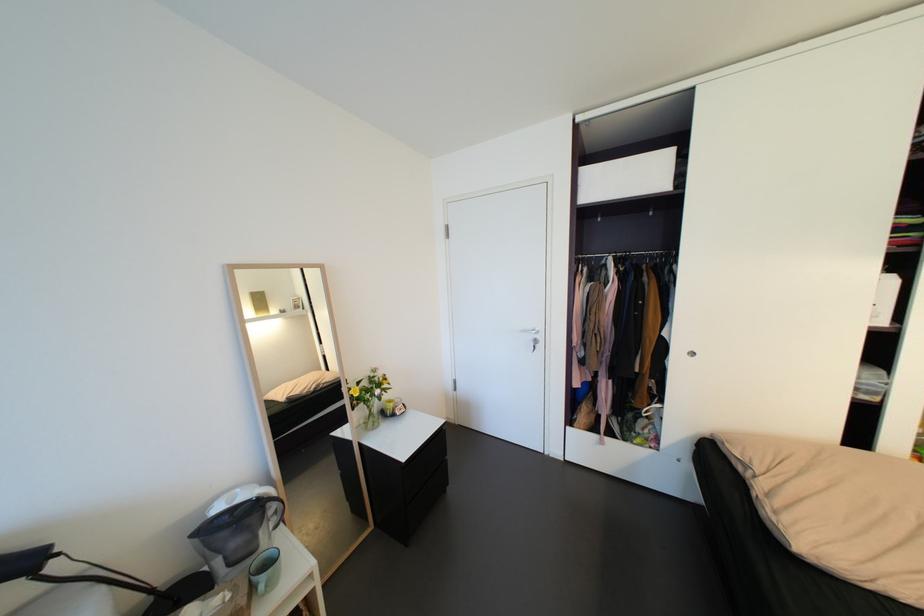
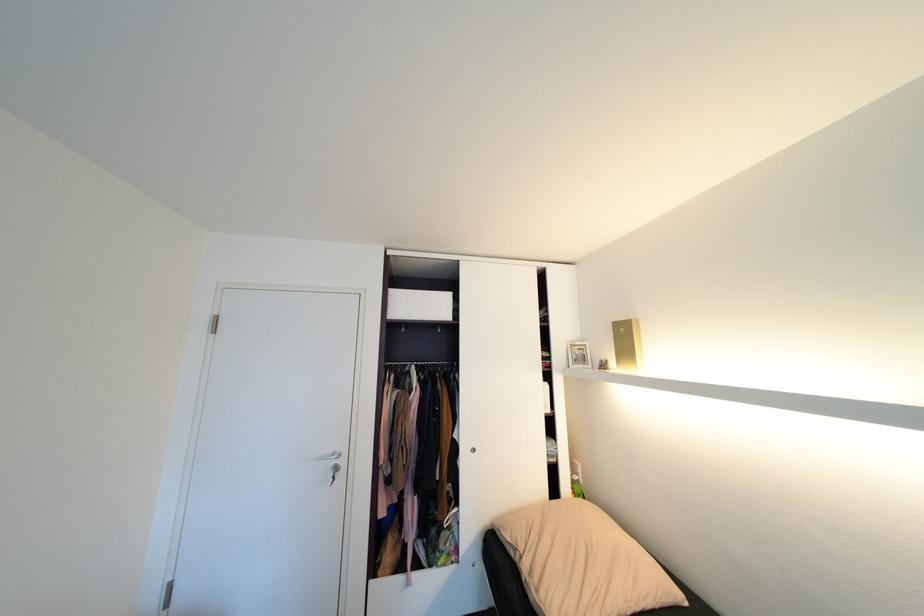
Where in the second image is the point corresponding to pixel 700 353 from the first image?

(481, 450)